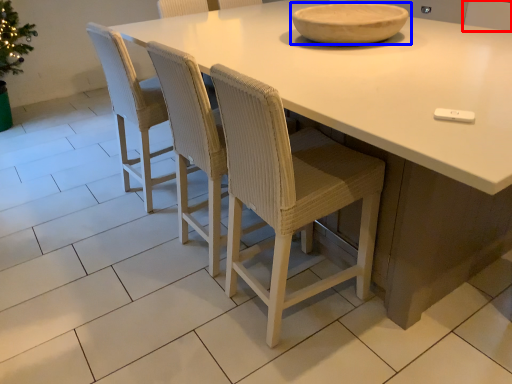
Question: Among these objects, which one is farthest to the camera, chair (highlighted by a red box) or bowl (highlighted by a blue box)?

Choices:
 (A) chair
 (B) bowl

Answer: (A)